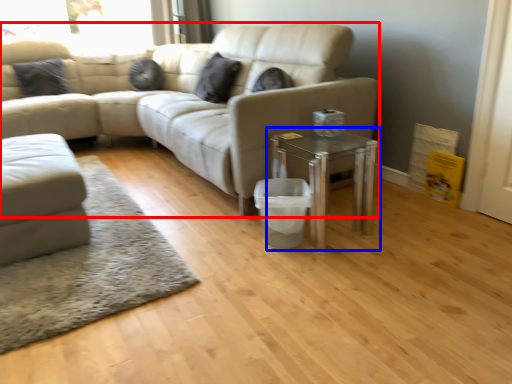
Question: Among these objects, which one is farthest to the camera, studio couch (highlighted by a red box) or table (highlighted by a blue box)?

Choices:
 (A) studio couch
 (B) table

Answer: (A)